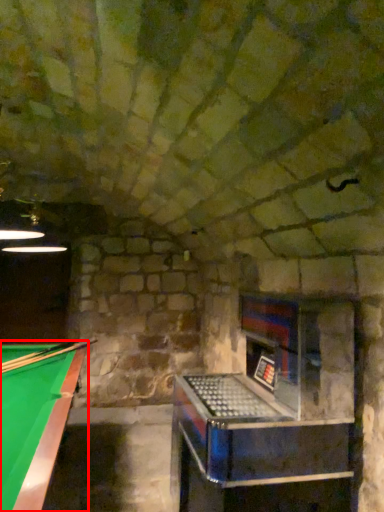
Question: From the image, what is the correct spatial relationship of billiard table (annotated by the red box) in relation to cue?

Choices:
 (A) right
 (B) left

Answer: (B)